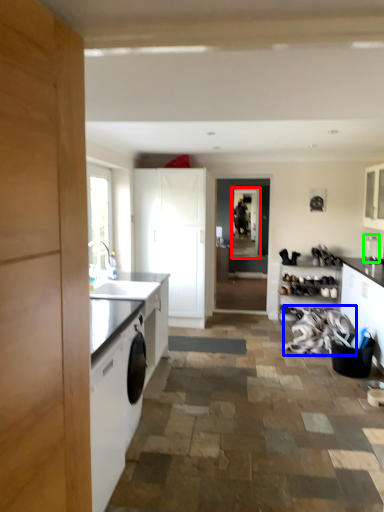
Question: Which object is positioned farthest from screen door (highlighted by a red box)? Select from laundry (highlighted by a blue box) and appliance (highlighted by a green box).

Choices:
 (A) laundry
 (B) appliance

Answer: (B)